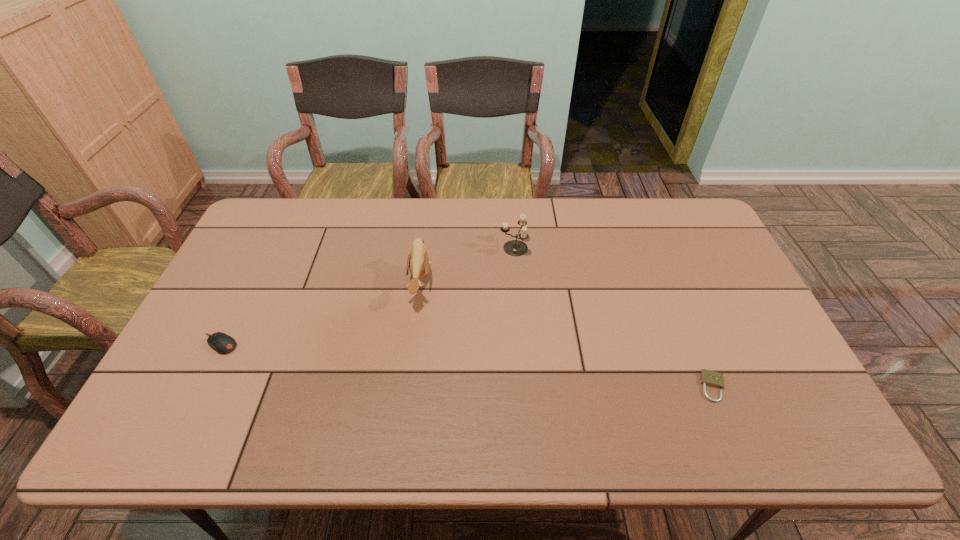
Identify the location of the third object from left to right. (516, 248).

The image size is (960, 540). What are the coordinates of `the third object from right to left` in the screenshot? It's located at (418, 262).

Find the location of `the second nearest object`. the second nearest object is located at coordinates (222, 343).

Image resolution: width=960 pixels, height=540 pixels. In order to click on computer mouse in this screenshot , I will do `click(222, 343)`.

Locate an element on the screen. This screenshot has height=540, width=960. the shortest object is located at coordinates point(711,378).

The height and width of the screenshot is (540, 960). Identify the location of the nearest object. pyautogui.click(x=711, y=378).

Find the location of `vacant space located 0.130m on the front of the candle holder`. vacant space located 0.130m on the front of the candle holder is located at coordinates (516, 288).

This screenshot has height=540, width=960. What are the coordinates of `free space located 0.250m at the beak of the bird` in the screenshot? It's located at (514, 284).

The image size is (960, 540). Find the location of `vacant space situated 0.210m on the back of the third farthest object`. vacant space situated 0.210m on the back of the third farthest object is located at coordinates (252, 278).

Find the location of a particular element. The width and height of the screenshot is (960, 540). blank space located 0.080m on the right of the padlock is located at coordinates (758, 387).